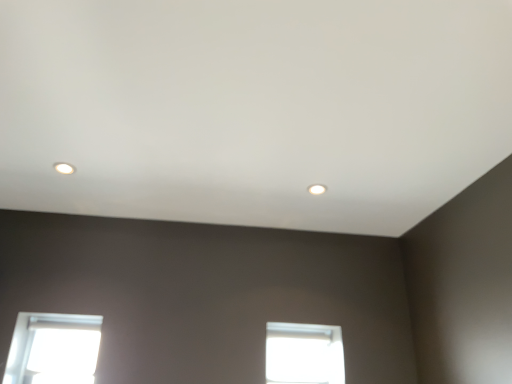
Question: In which direction should I rotate to look at transparent glass window at center, which is the second window from left to right?

Choices:
 (A) right
 (B) left

Answer: (A)

Question: Does matte white light fixture at upper left, the 2th lighting when ordered from bottom to top, have a larger size compared to matte white light fixture at upper center, positioned as the second lighting in top-to-bottom order?

Choices:
 (A) yes
 (B) no

Answer: (B)

Question: Does matte white light fixture at upper left, which ranks as the first lighting in left-to-right order, have a greater width compared to matte white light fixture at upper center, which appears as the 1th lighting when viewed from the right?

Choices:
 (A) no
 (B) yes

Answer: (A)

Question: Is matte white light fixture at upper left, the 2th lighting when ordered from bottom to top, surrounding matte white light fixture at upper center, marked as the 2th lighting in a left-to-right arrangement?

Choices:
 (A) no
 (B) yes

Answer: (A)

Question: Is matte white light fixture at upper left, the 1th lighting in the top-to-bottom sequence, oriented towards matte white light fixture at upper center, positioned as the second lighting in top-to-bottom order?

Choices:
 (A) yes
 (B) no

Answer: (A)

Question: Considering the relative positions of matte white light fixture at upper left, the 1th lighting in the top-to-bottom sequence, and matte white light fixture at upper center, which is the 1th lighting from bottom to top, in the image provided, is matte white light fixture at upper left, the 1th lighting in the top-to-bottom sequence, in front of matte white light fixture at upper center, which is the 1th lighting from bottom to top,?

Choices:
 (A) no
 (B) yes

Answer: (B)

Question: Considering the relative positions of matte white light fixture at upper left, the 2th lighting positioned from the right, and matte white light fixture at upper center, which is the 1th lighting from bottom to top, in the image provided, is matte white light fixture at upper left, the 2th lighting positioned from the right, behind matte white light fixture at upper center, which is the 1th lighting from bottom to top,?

Choices:
 (A) yes
 (B) no

Answer: (B)

Question: Is matte white light fixture at upper left, positioned as the second lighting in back-to-front order, smaller than transparent glass window at center, which is the second window from left to right?

Choices:
 (A) no
 (B) yes

Answer: (B)

Question: Is matte white light fixture at upper left, the 2th lighting positioned from the right, taller than transparent glass window at center, which is the second window from left to right?

Choices:
 (A) no
 (B) yes

Answer: (A)

Question: Could you tell me if matte white light fixture at upper left, the 1th lighting in the top-to-bottom sequence, is turned towards transparent glass window at center, which is the second window from left to right?

Choices:
 (A) no
 (B) yes

Answer: (A)

Question: Is matte white light fixture at upper left, which ranks as the first lighting in left-to-right order, next to transparent glass window at center, positioned as the 1th window in right-to-left order?

Choices:
 (A) yes
 (B) no

Answer: (B)

Question: Considering the relative sizes of matte white light fixture at upper left, which ranks as the first lighting in left-to-right order, and transparent glass window at center, which is the second window from left to right, in the image provided, is matte white light fixture at upper left, which ranks as the first lighting in left-to-right order, wider than transparent glass window at center, which is the second window from left to right,?

Choices:
 (A) yes
 (B) no

Answer: (A)

Question: Does matte white light fixture at upper left, the 2th lighting when ordered from bottom to top, appear on the right side of transparent glass window at center, positioned as the 1th window in right-to-left order?

Choices:
 (A) yes
 (B) no

Answer: (B)

Question: From a real-world perspective, is transparent glass window at lower left, which is the 2th window in right-to-left order, beneath matte white light fixture at upper center, which appears as the 1th lighting when viewed from the right?

Choices:
 (A) no
 (B) yes

Answer: (B)